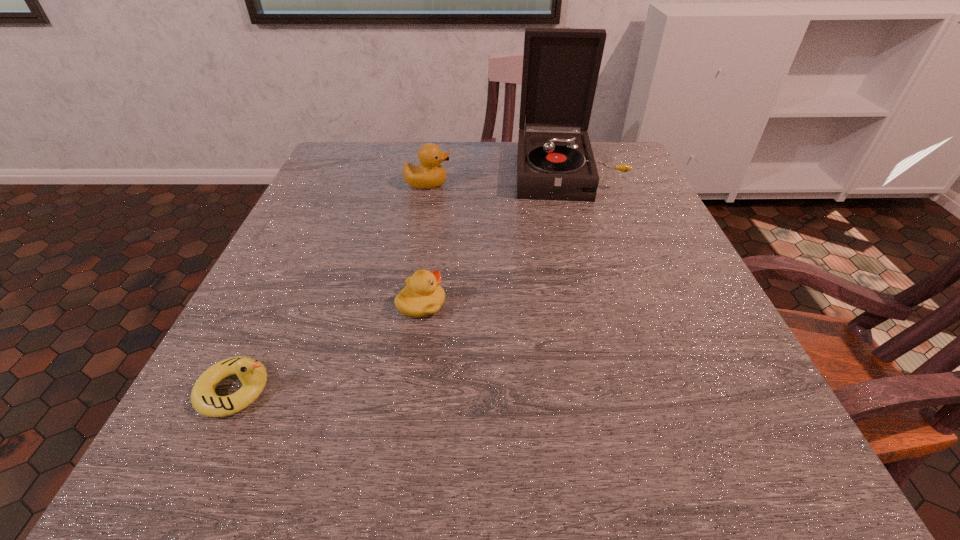
The width and height of the screenshot is (960, 540). In order to click on vacant space located on the face of the leftmost duckling in this screenshot , I will do `click(413, 390)`.

Where is `phonograph record located in the far edge section of the desktop`? phonograph record located in the far edge section of the desktop is located at coordinates (561, 66).

I want to click on duckling at the far edge, so click(x=430, y=174).

Identify the location of object located in the left edge section of the desktop. (251, 372).

Find the location of a particular element. This screenshot has height=540, width=960. object present at the right edge is located at coordinates (561, 66).

Where is `object present at the far right corner`? The width and height of the screenshot is (960, 540). object present at the far right corner is located at coordinates (561, 66).

Locate an element on the screen. The height and width of the screenshot is (540, 960). vacant point at the far edge is located at coordinates (444, 146).

I want to click on vacant area at the near edge of the desktop, so click(x=380, y=463).

You are a GUI agent. You are given a task and a screenshot of the screen. Output one action in this format:
    pyautogui.click(x=<x>, y=<y>)
    Task: Click on the vacant space at the left edge
    The height and width of the screenshot is (540, 960).
    Given the screenshot: What is the action you would take?
    pyautogui.click(x=254, y=345)

Locate an element on the screen. The image size is (960, 540). vacant space at the right edge of the desktop is located at coordinates (619, 305).